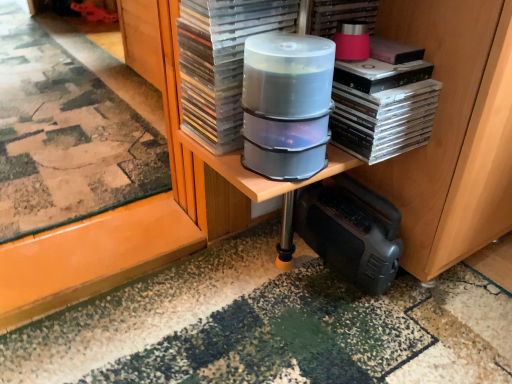
Locate an element on the screen. vacant area in front of black plastic speaker at lower right, placed as the 2th appliance when sorted from top to bottom is located at coordinates (361, 333).